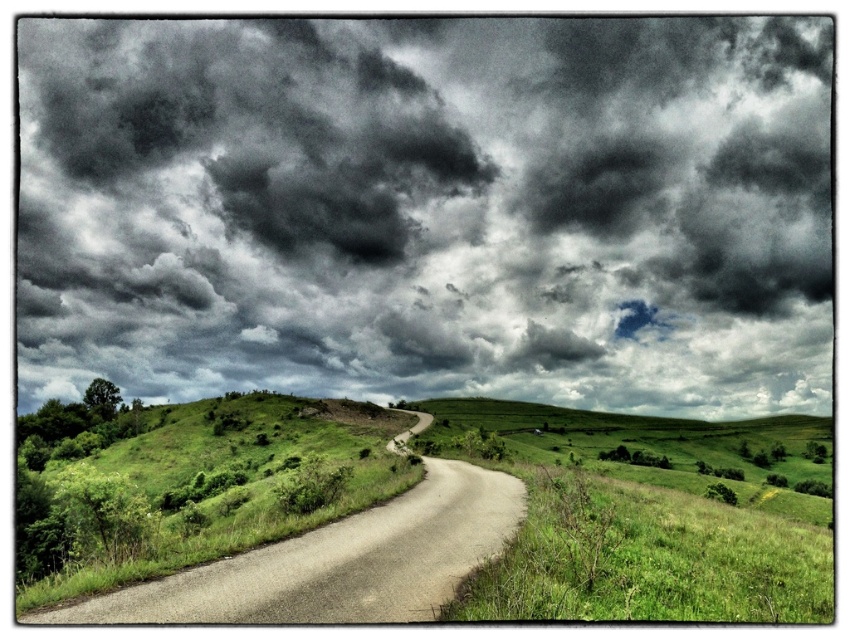
In the scene shown: You are a weather observer assessing the image. The dark textured clouds at upper center and the green grassy at lower right are both visible. Which object covers a wider area in the image?

The dark textured clouds at upper center covers a wider area than the green grassy at lower right as stated in the description.

You are standing at the edge of the green grassy at lower right and want to walk to the smooth asphalt road at center. Which direction should you head to reach the road?

Since the green grassy at lower right is to the right of the smooth asphalt road at center, you should head to the left to reach the road.

From the picture: You are standing at the starting point of the road in the rural landscape. You notice two points marked on the image, point [230,323] and point [585,588]. Which point is closer to you as you stand at the road beginning?

Point [230,323] is closer to you because it is further to the viewer than point [585,588].